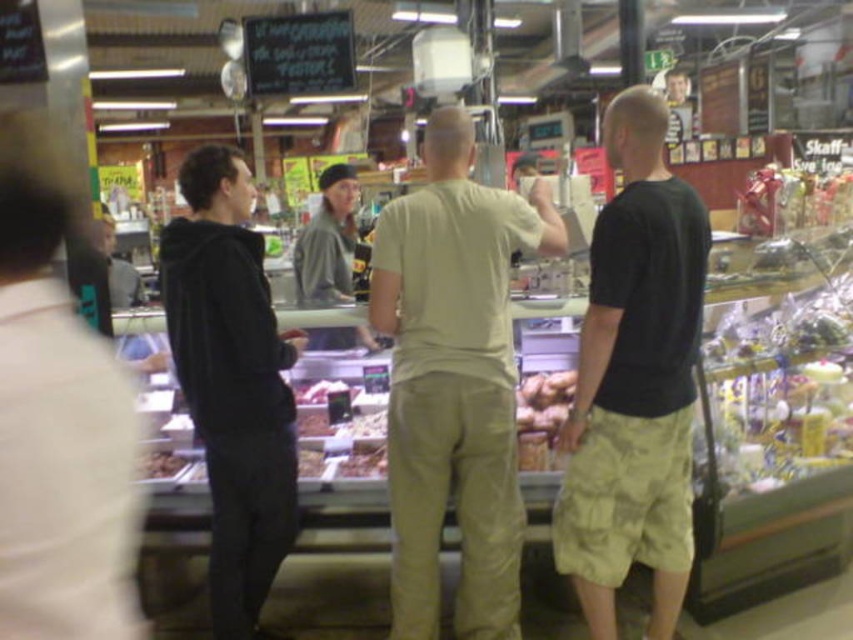
You are standing at the point labeled as point [454,381] in the image. What object is directly in front of you?

The point [454,381] corresponds to the light beige cotton t shirt at center, so the object directly in front of you is the light beige cotton t shirt at center.

You are a customer in the deli and want to compare the sizes of the black matte hoodie at left and the brown textured meat at center. Which one is wider?

The black matte hoodie at left is wider than the brown textured meat at center.